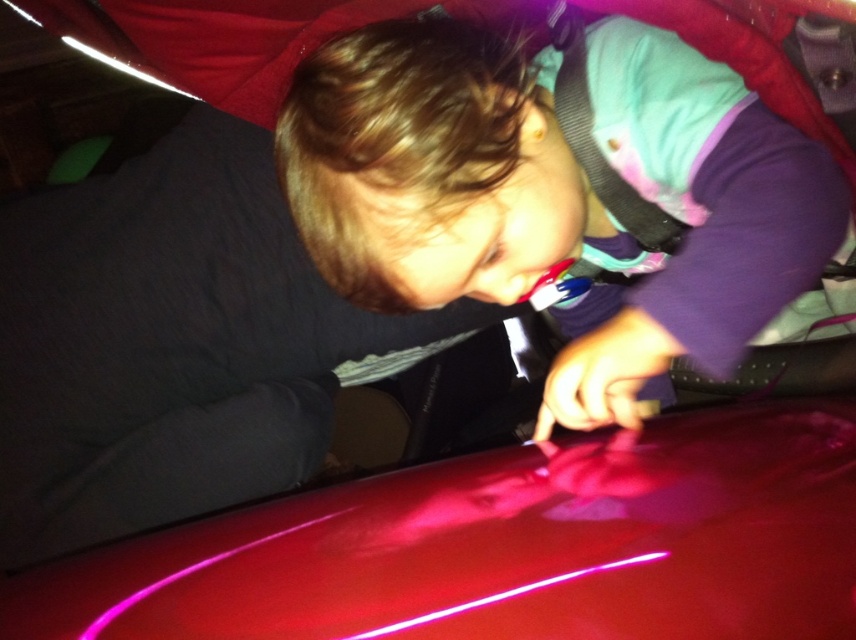
Question: Can you confirm if matte purple shirt at center is positioned below glossy red car at center?

Choices:
 (A) no
 (B) yes

Answer: (A)

Question: Which point is closer to the camera taking this photo?

Choices:
 (A) (616, 417)
 (B) (595, 538)

Answer: (B)

Question: Is the position of matte purple shirt at center less distant than that of glossy red car at center?

Choices:
 (A) yes
 (B) no

Answer: (B)

Question: Does matte purple shirt at center appear under glossy red car at center?

Choices:
 (A) yes
 (B) no

Answer: (B)

Question: Which object is closer to the camera taking this photo?

Choices:
 (A) glossy red car at center
 (B) matte purple shirt at center

Answer: (A)

Question: Which point is farther to the camera?

Choices:
 (A) (843, 461)
 (B) (557, 148)

Answer: (B)